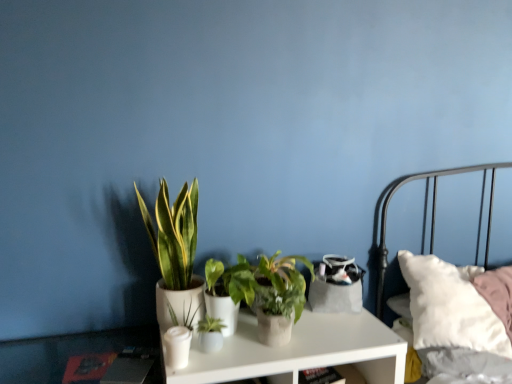
Where is `free space in front of green matte plant at center, which is counted as the first houseplant, starting from the right`? The width and height of the screenshot is (512, 384). free space in front of green matte plant at center, which is counted as the first houseplant, starting from the right is located at coordinates (309, 345).